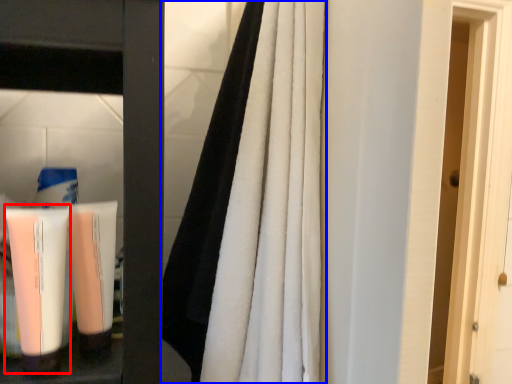
Question: Which object appears closest to the camera in this image, cleaning product (highlighted by a red box) or curtain (highlighted by a blue box)?

Choices:
 (A) cleaning product
 (B) curtain

Answer: (B)